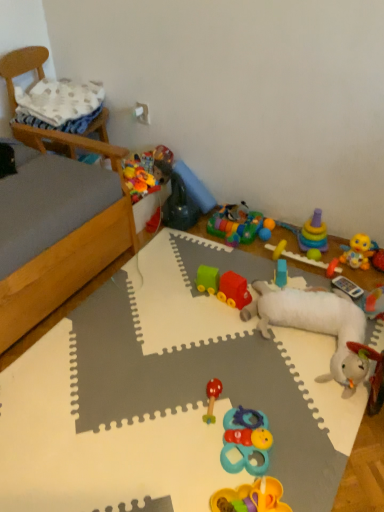
You are a GUI agent. You are given a task and a screenshot of the screen. Output one action in this format:
    pyautogui.click(x=<x>, y=<y>)
    Task: Click on the free point in front of multicolored plastic blocks at center, acting as the ninth toy starting from the bottom
    
    Given the screenshot: What is the action you would take?
    pyautogui.click(x=238, y=254)